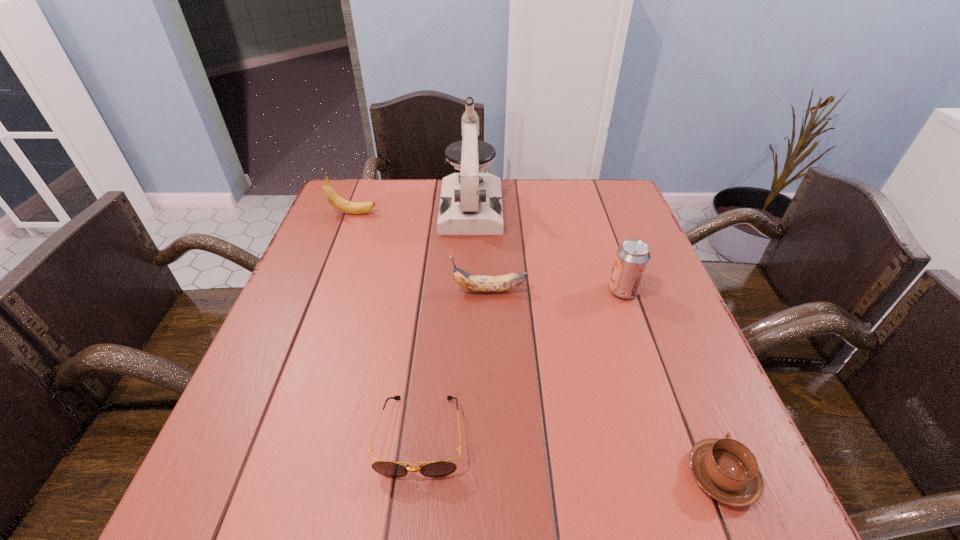
The image size is (960, 540). In the image, there is a desktop. Find the location of `vacant space at the far right corner`. vacant space at the far right corner is located at coordinates (582, 219).

The width and height of the screenshot is (960, 540). I want to click on free space at the near right corner of the desktop, so click(x=693, y=505).

Find the location of a particular element. The image size is (960, 540). free space between the tallest object and the sunglasses is located at coordinates (445, 322).

Find the location of a particular element. This screenshot has width=960, height=540. free space between the cappuccino and the beer can is located at coordinates (672, 383).

You are a GUI agent. You are given a task and a screenshot of the screen. Output one action in this format:
    pyautogui.click(x=<x>, y=<y>)
    Task: Click on the empty location between the beer can and the cappuccino
    
    Given the screenshot: What is the action you would take?
    pyautogui.click(x=672, y=383)

The height and width of the screenshot is (540, 960). I want to click on vacant region between the sunglasses and the beer can, so click(x=521, y=363).

The width and height of the screenshot is (960, 540). Find the location of `vacant area that lies between the third shortest object and the sunglasses`. vacant area that lies between the third shortest object and the sunglasses is located at coordinates (455, 363).

Identify the location of vacant area between the sunglasses and the beer can. pos(521,363).

Where is `unoccupied area between the cappuccino and the microscope`? Image resolution: width=960 pixels, height=540 pixels. unoccupied area between the cappuccino and the microscope is located at coordinates (596, 342).

This screenshot has height=540, width=960. Find the location of `free space between the farther banana and the sunglasses`. free space between the farther banana and the sunglasses is located at coordinates click(x=387, y=325).